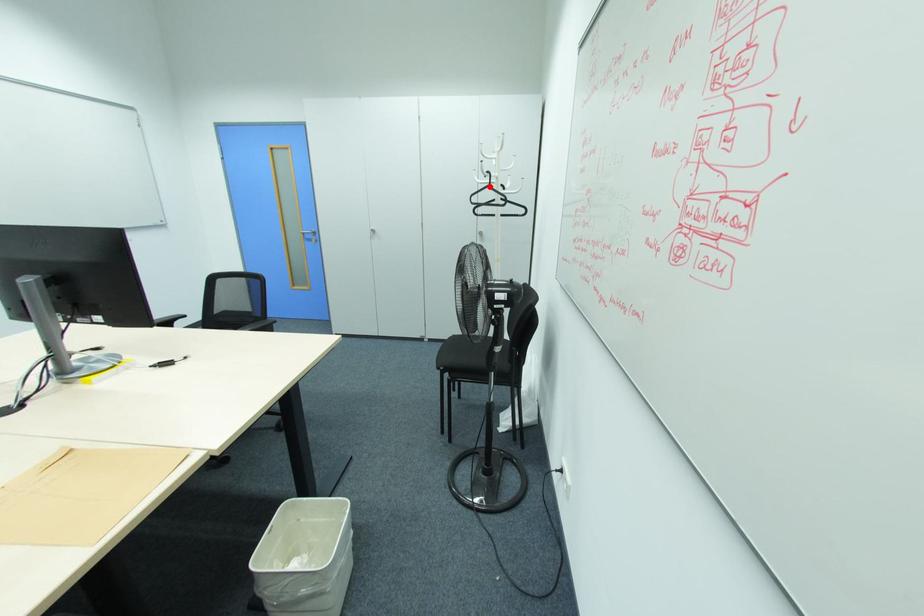
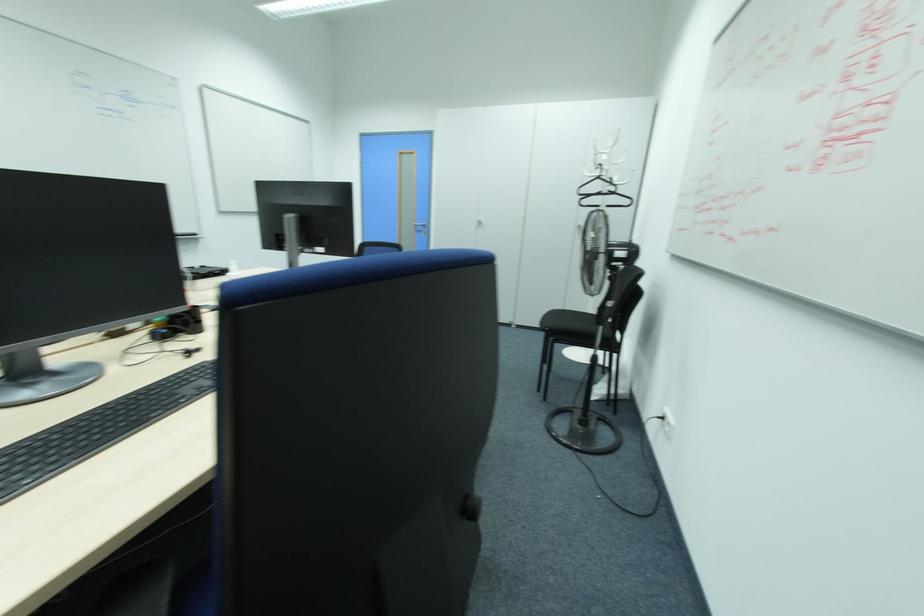
The point at the highlighted location is marked in the first image. Where is the corresponding point in the second image?

(599, 177)